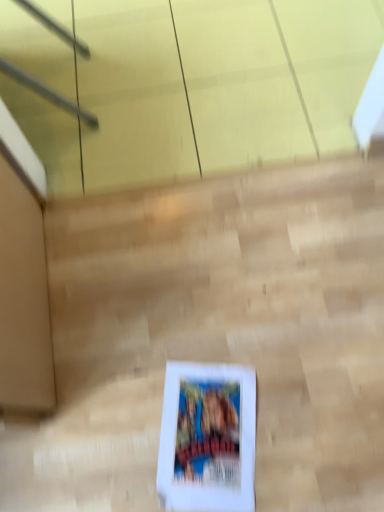
What are the coordinates of `white cardboard box at center` in the screenshot? It's located at (223, 328).

Describe the element at coordinates (223, 328) in the screenshot. I see `white cardboard box at center` at that location.

What do you see at coordinates (208, 438) in the screenshot? I see `white paper at center` at bounding box center [208, 438].

Where is `white paper at center`? white paper at center is located at coordinates (208, 438).

In order to face white paper at center, should I rotate leftwards or rightwards?

Rotate your view right by about 2.258°.

At what (x,y) coordinates should I click in order to perform the action: click on white cardboard box at center. Please return your answer as a coordinate pair (x, y). The width and height of the screenshot is (384, 512). Looking at the image, I should click on (223, 328).

Looking at this image, considering the relative positions of white paper at center and white cardboard box at center in the image provided, is white paper at center to the right of white cardboard box at center from the viewer's perspective?

No, white paper at center is not to the right of white cardboard box at center.

Which is behind, white paper at center or white cardboard box at center?

white paper at center is further away from the camera.

Is point (242, 495) behind point (291, 290)?

No, (242, 495) is in front of (291, 290).

From the image's perspective, which is below, white paper at center or white cardboard box at center?

From the image's view, white paper at center is below.

From a real-world perspective, between white paper at center and white cardboard box at center, who is vertically higher?

In real-world perspective, white cardboard box at center is above.

Between white paper at center and white cardboard box at center, which one has larger width?

white cardboard box at center.

Which of these two, white paper at center or white cardboard box at center, stands taller?

Standing taller between the two is white cardboard box at center.

Between white paper at center and white cardboard box at center, which one has smaller size?

white paper at center is smaller.

Would you say white cardboard box at center is part of white paper at center's contents?

No, white paper at center does not contain white cardboard box at center.

Is white paper at center not near white cardboard box at center?

white paper at center is near white cardboard box at center, not far away.

Does white paper at center turn towards white cardboard box at center?

Yes.

How different are the orientations of white paper at center and white cardboard box at center in degrees?

The angle between the facing direction of white paper at center and the facing direction of white cardboard box at center is 12.8 degrees.

How much distance is there between white paper at center and white cardboard box at center?

white paper at center and white cardboard box at center are 7.00 inches apart from each other.

At what (x,y) coordinates should I click in order to perform the action: click on picture frame lying behind the white cardboard box at center. Please return your answer as a coordinate pair (x, y). Looking at the image, I should click on (208, 438).

Based on their positions, is white cardboard box at center located to the left or right of white paper at center?

white cardboard box at center is positioned on white paper at center's right side.

Is white cardboard box at center positioned in front of white paper at center?

Yes, it is in front of white paper at center.

Is point (302, 166) behind point (190, 428)?

That is True.

From the image's perspective, which is above, white cardboard box at center or white paper at center?

white cardboard box at center appears higher in the image.

Consider the image. From a real-world perspective, between white cardboard box at center and white paper at center, who is vertically lower?

white paper at center is physically lower.

Considering the sizes of objects white cardboard box at center and white paper at center in the image provided, who is wider, white cardboard box at center or white paper at center?

With larger width is white cardboard box at center.

Based on the photo, between white cardboard box at center and white paper at center, which one has more height?

Standing taller between the two is white cardboard box at center.

Considering the sizes of objects white cardboard box at center and white paper at center in the image provided, who is bigger, white cardboard box at center or white paper at center?

Bigger between the two is white cardboard box at center.

Is white paper at center a part of white cardboard box at center?

Yes.

Looking at this image, are white cardboard box at center and white paper at center beside each other?

No, white cardboard box at center is not with white paper at center.

Is white cardboard box at center oriented away from white paper at center?

Yes, white cardboard box at center is facing away from white paper at center.

In the scene shown: Can you tell me how much white cardboard box at center and white paper at center differ in facing direction?

The angular difference between white cardboard box at center and white paper at center is 12.8 degrees.

You are a GUI agent. You are given a task and a screenshot of the screen. Output one action in this format:
    pyautogui.click(x=<x>, y=<y>)
    Task: Click on the stairwell that is above the white paper at center (from the image's perspective)
    
    Given the screenshot: What is the action you would take?
    pyautogui.click(x=223, y=328)

Locate an element on the screen. The width and height of the screenshot is (384, 512). stairwell that appears on the right of white paper at center is located at coordinates (223, 328).

Find the location of a particular element. picture frame behind the white cardboard box at center is located at coordinates (208, 438).